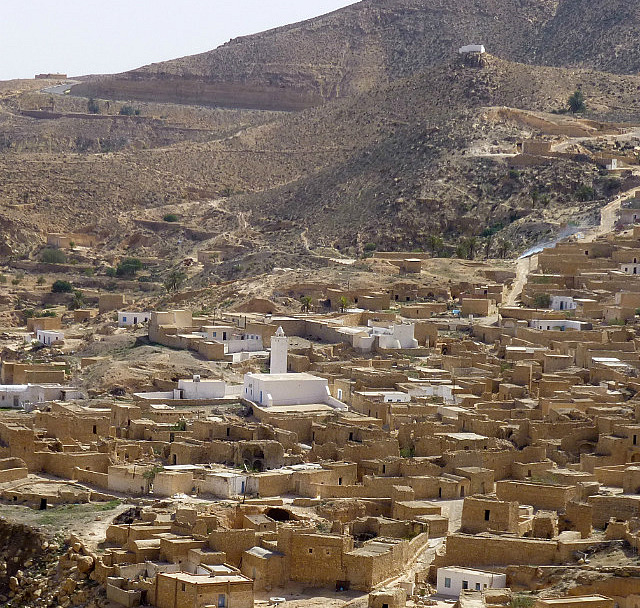
The height and width of the screenshot is (608, 640). Identify the location of door. (221, 599).